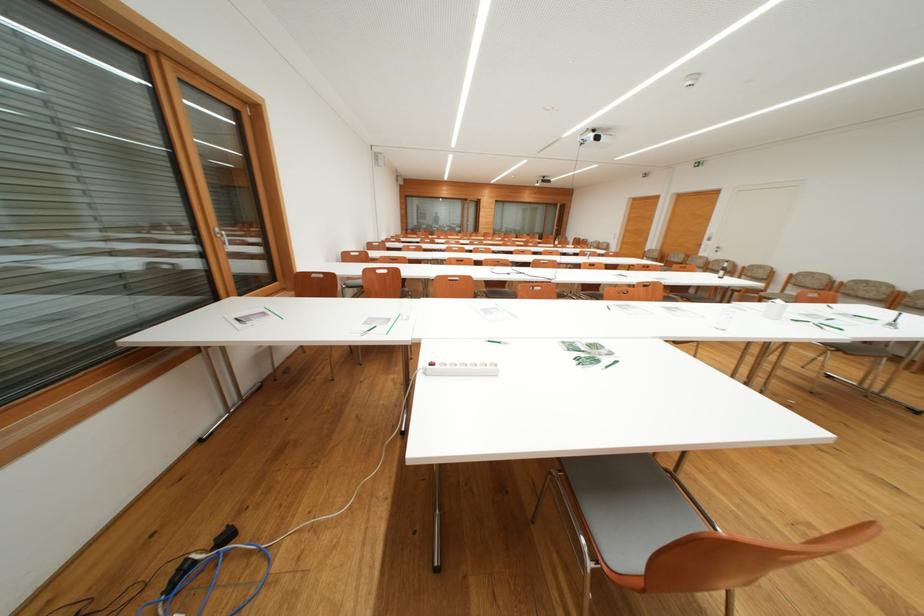
Where would you pull the silver window handle? Please return your answer as a coordinate pair (x, y).

(222, 237)